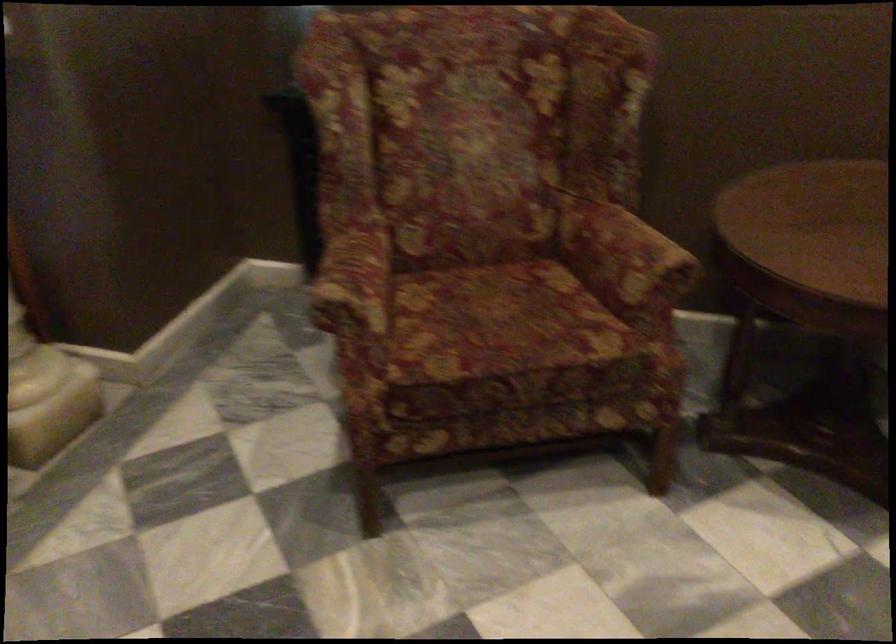
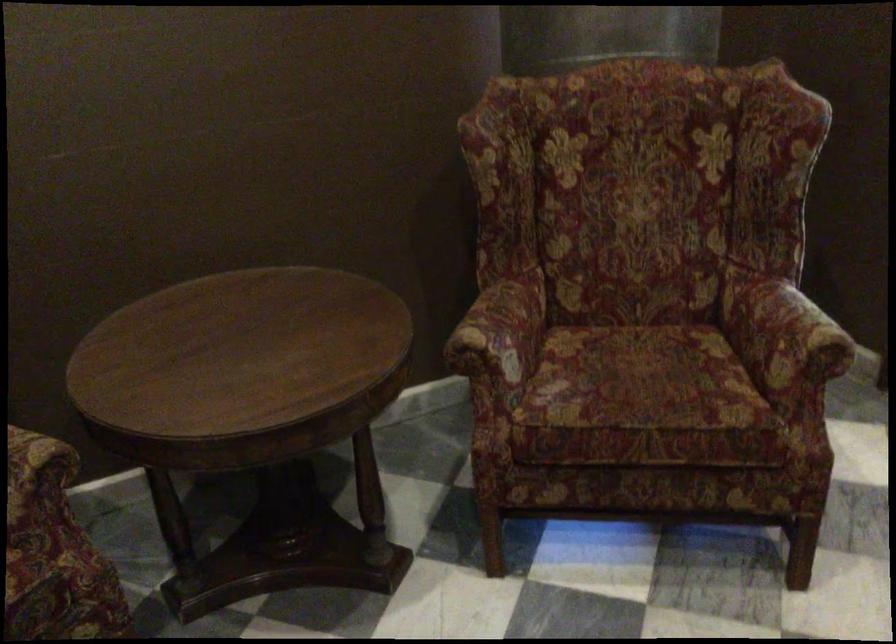
Question: The images are taken continuously from a first-person perspective. In which direction is your viewpoint rotating?

Choices:
 (A) Left
 (B) Right
 (C) Up
 (D) Down

Answer: (B)